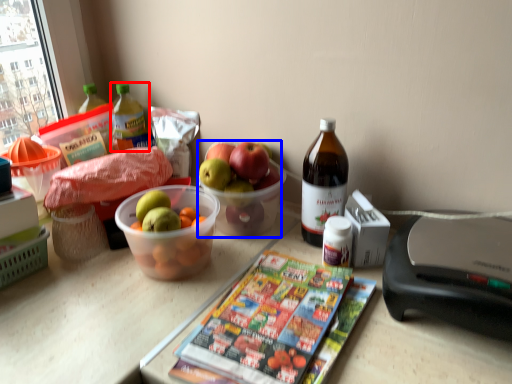
Question: Which of the following is the farthest to the observer, bottle (highlighted by a red box) or grapefruit (highlighted by a blue box)?

Choices:
 (A) bottle
 (B) grapefruit

Answer: (A)